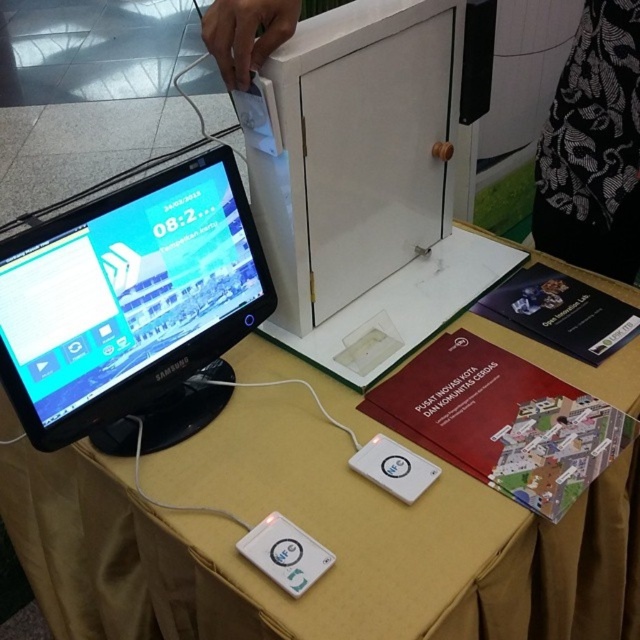
Can you confirm if yellow fabric table at center is positioned below matte black monitor at left?

Yes, yellow fabric table at center is below matte black monitor at left.

This screenshot has width=640, height=640. What do you see at coordinates (316, 538) in the screenshot?
I see `yellow fabric table at center` at bounding box center [316, 538].

Describe the element at coordinates (316, 538) in the screenshot. This screenshot has width=640, height=640. I see `yellow fabric table at center` at that location.

At what (x,y) coordinates should I click in order to perform the action: click on yellow fabric table at center. Please return your answer as a coordinate pair (x, y). The height and width of the screenshot is (640, 640). Looking at the image, I should click on (316, 538).

Between point (134, 323) and point (624, 17), which one is positioned behind?

Positioned behind is point (624, 17).

Measure the distance between matte black monitor at left and black lace dress at upper right.

A distance of 32.98 inches exists between matte black monitor at left and black lace dress at upper right.

Image resolution: width=640 pixels, height=640 pixels. What are the coordinates of `matte black monitor at left` in the screenshot? It's located at (131, 307).

Image resolution: width=640 pixels, height=640 pixels. In order to click on matte black monitor at left in this screenshot , I will do (x=131, y=307).

Is matte black monitor at left positioned at the back of white plastic ipod at lower center?

No.

Is matte black monitor at left closer to camera compared to white plastic ipod at lower center?

Yes, it is in front of white plastic ipod at lower center.

Which is behind, point (22, 332) or point (404, 460)?

The point (404, 460) is more distant.

I want to click on matte black monitor at left, so click(131, 307).